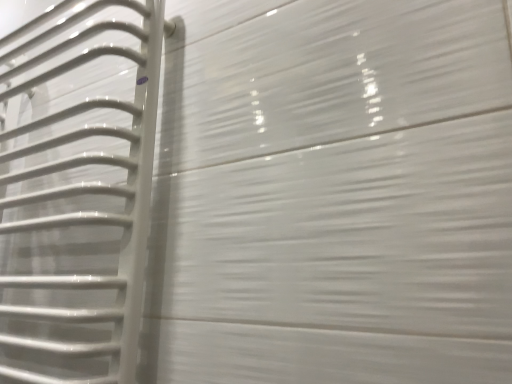
The image size is (512, 384). Describe the element at coordinates (76, 201) in the screenshot. I see `white glossy towel rack at left` at that location.

Locate an element on the screen. The image size is (512, 384). white glossy towel rack at left is located at coordinates (76, 201).

Locate an element on the screen. Image resolution: width=512 pixels, height=384 pixels. white glossy towel rack at left is located at coordinates (76, 201).